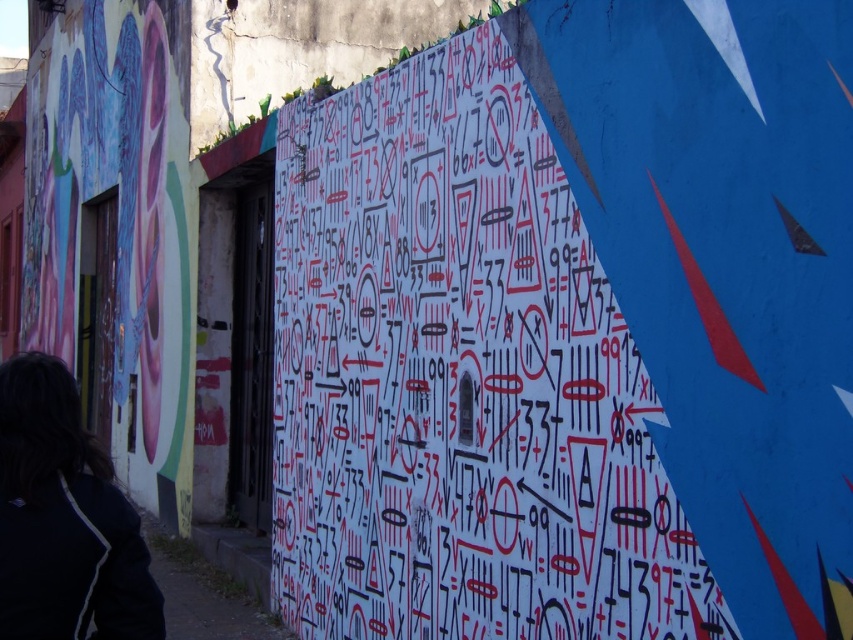
Which is more to the right, white paper with red and black markings at center or black fabric at lower left?

Positioned to the right is white paper with red and black markings at center.

Can you confirm if white paper with red and black markings at center is wider than black fabric at lower left?

Yes, white paper with red and black markings at center is wider than black fabric at lower left.

Is point (555, 298) positioned in front of point (161, 596)?

No, it is behind (161, 596).

At what (x,y) coordinates should I click in order to perform the action: click on white paper with red and black markings at center. Please return your answer as a coordinate pair (x, y). The image size is (853, 640). Looking at the image, I should click on (459, 380).